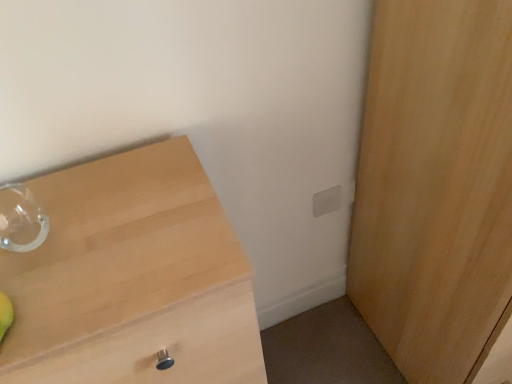
Question: Is light wood chest of drawers at left to the left or to the right of white matte electric outlet at upper right in the image?

Choices:
 (A) left
 (B) right

Answer: (A)

Question: Considering their positions, is light wood chest of drawers at left located in front of or behind white matte electric outlet at upper right?

Choices:
 (A) behind
 (B) front

Answer: (B)

Question: Which object is positioned closest to the light wood chest of drawers at left?

Choices:
 (A) light wood cupboard at right
 (B) white matte electric outlet at upper right

Answer: (A)

Question: Estimate the real-world distances between objects in this image. Which object is farther from the light wood chest of drawers at left?

Choices:
 (A) light wood cupboard at right
 (B) white matte electric outlet at upper right

Answer: (B)